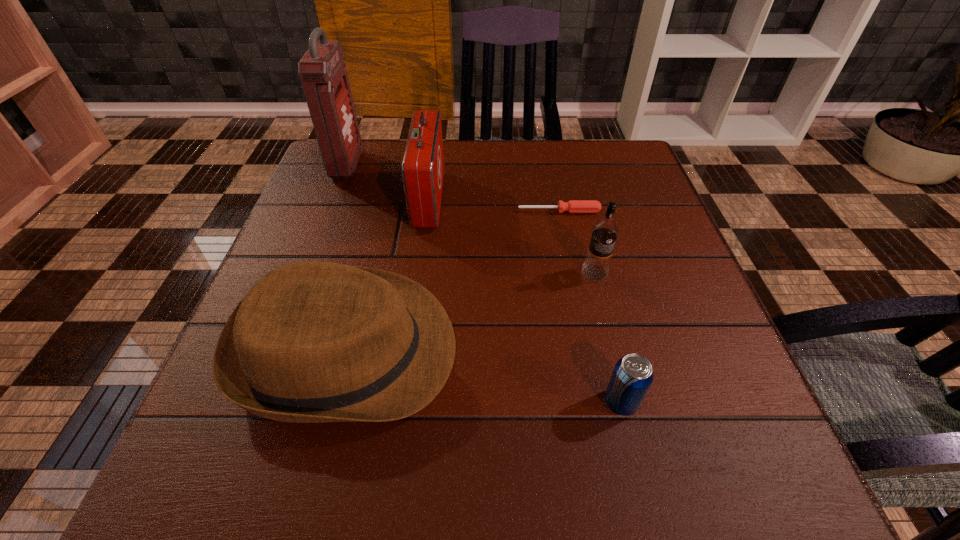
I want to click on the left first-aid kit, so click(323, 73).

Find the location of a particular element. the tallest object is located at coordinates (323, 73).

Locate an element on the screen. The width and height of the screenshot is (960, 540). the second tallest object is located at coordinates (422, 167).

The width and height of the screenshot is (960, 540). In order to click on the shorter first-aid kit in this screenshot , I will do `click(422, 167)`.

Image resolution: width=960 pixels, height=540 pixels. I want to click on vodka, so click(x=605, y=231).

At what (x,y) coordinates should I click in order to perform the action: click on the fourth shortest object. Please return your answer as a coordinate pair (x, y). Looking at the image, I should click on (605, 231).

Identify the location of the third shortest object. The width and height of the screenshot is (960, 540). click(311, 342).

Image resolution: width=960 pixels, height=540 pixels. Identify the location of beer can. (633, 375).

This screenshot has height=540, width=960. What are the coordinates of `the shortest object` in the screenshot? It's located at (573, 206).

The height and width of the screenshot is (540, 960). What are the coordinates of `free space located 0.200m on the front-facing side of the left first-aid kit` in the screenshot? It's located at (435, 165).